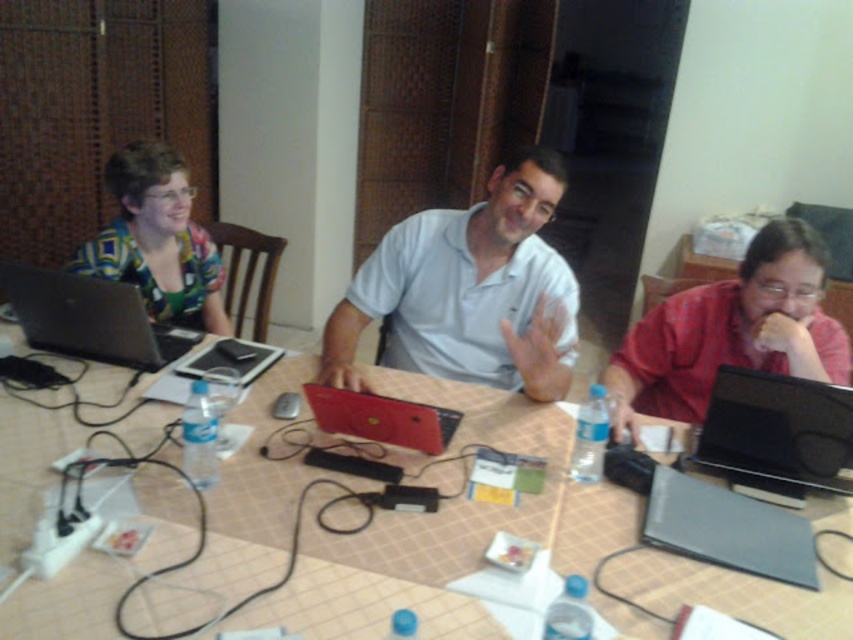
Question: Which point is farther to the camera?

Choices:
 (A) brown tile table at center
 (B) matte black laptop at left

Answer: (B)

Question: Which is farther from the brown tile table at center?

Choices:
 (A) matte multicolored shirt at upper left
 (B) red matte shirt at right
 (C) matte black laptop at left

Answer: (A)

Question: Does matte multicolored shirt at upper left appear on the right side of black plastic laptop at right?

Choices:
 (A) no
 (B) yes

Answer: (A)

Question: Is matte multicolored shirt at upper left below black plastic laptop at right?

Choices:
 (A) yes
 (B) no

Answer: (B)

Question: Which object is closer to the camera taking this photo?

Choices:
 (A) matte black laptop at left
 (B) light blue cotton shirt at center
 (C) matte multicolored shirt at upper left
 (D) red matte shirt at right

Answer: (D)

Question: Can you confirm if matte multicolored shirt at upper left is positioned above matte black laptop at left?

Choices:
 (A) yes
 (B) no

Answer: (A)